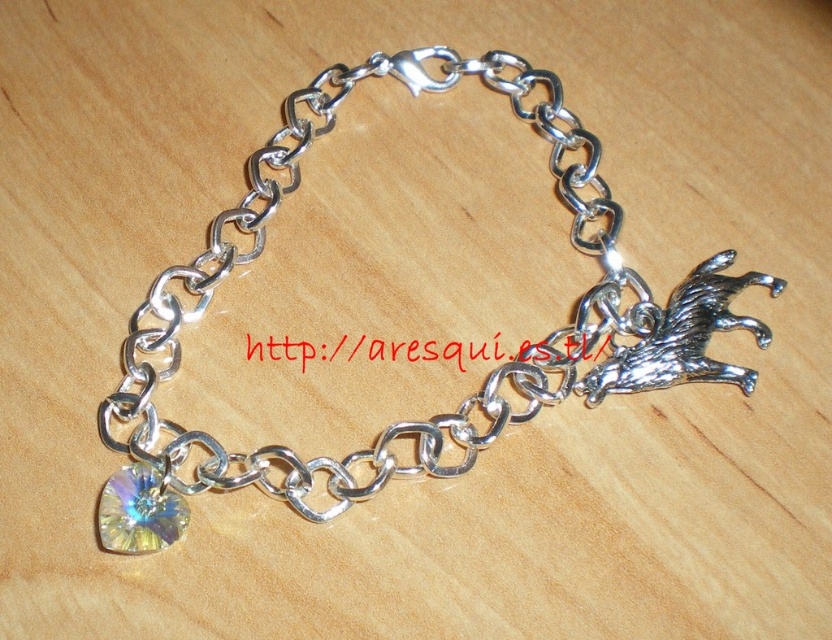
Who is positioned more to the right, silver metallic chain at center or rainbow crystal charm at bottom left?

From the viewer's perspective, silver metallic chain at center appears more on the right side.

Looking at this image, between silver metallic chain at center and rainbow crystal charm at bottom left, which one has less height?

rainbow crystal charm at bottom left is shorter.

What do you see at coordinates (494, 369) in the screenshot? I see `silver metallic chain at center` at bounding box center [494, 369].

Where is `silver metallic chain at center`? This screenshot has height=640, width=832. silver metallic chain at center is located at coordinates (494, 369).